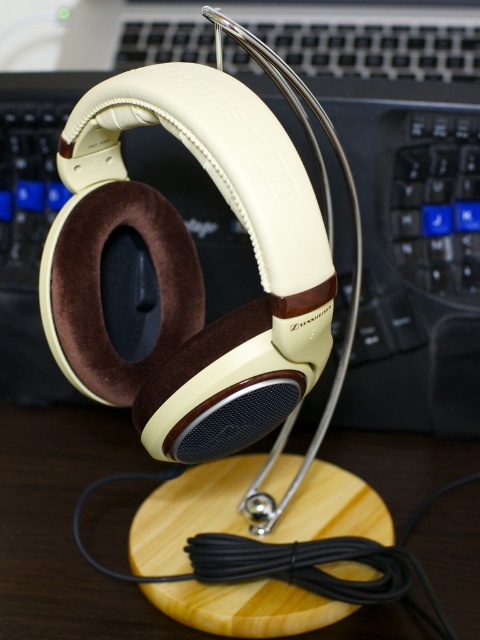
You are a customer in a store and see the point marked at coordinates [400,193] in the image. What object is located at that point?

The point at coordinates [400,193] marks the matte cream leather headphones at center.

You are a delivery person who needs to place the matte cream leather headphones at center into a box that can only accommodate items up to the width of the wooden table at center. Based on the scene, will the headphones fit?

The matte cream leather headphones at center are wider than the wooden table at center, so they will not fit into the box designed for the table width.